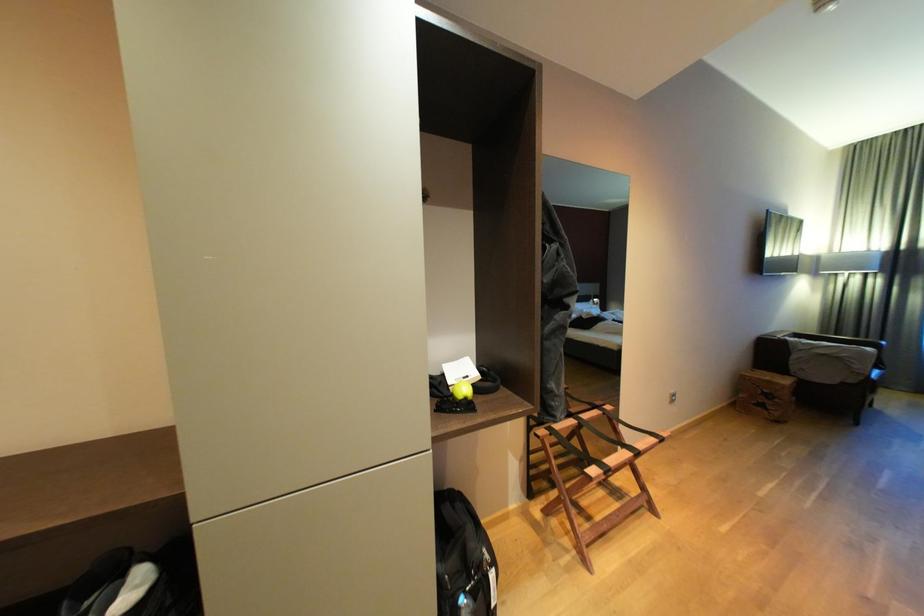
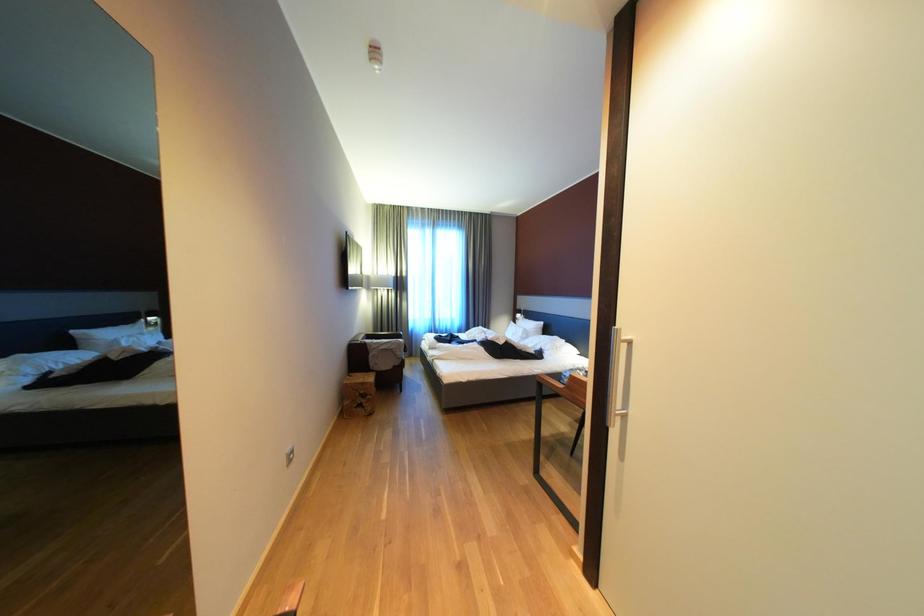
Question: The camera is either moving clockwise (left) or counter-clockwise (right) around the object. The first image is from the beginning of the video and the second image is from the end. Is the camera moving left or right when shooting the video?

Choices:
 (A) Left
 (B) Right

Answer: (A)